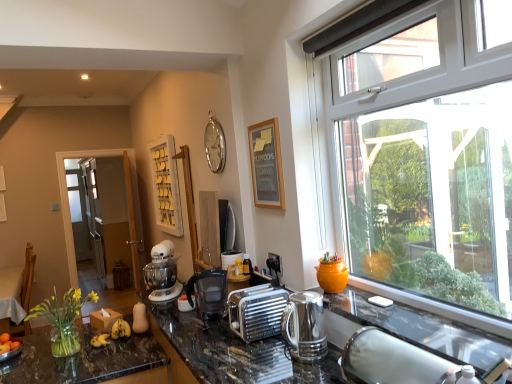
You are a GUI agent. You are given a task and a screenshot of the screen. Output one action in this format:
    pyautogui.click(x=<x>, y=<y>)
    Task: Click on the vacant area that is in front of black plastic coffee machine at center, which appears as the 1th coffee machine when viewed from the left
    The image size is (512, 384).
    Given the screenshot: What is the action you would take?
    pyautogui.click(x=206, y=329)